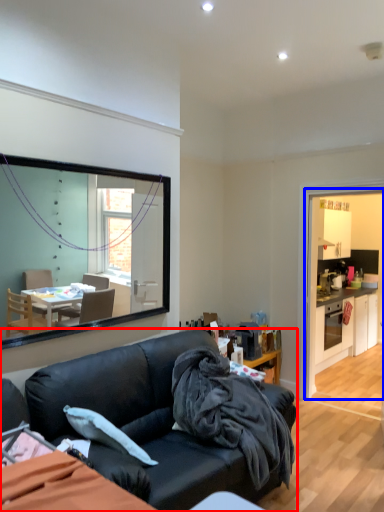
Question: Which point is closer to the camera, studio couch (highlighted by a red box) or dresser (highlighted by a blue box)?

Choices:
 (A) studio couch
 (B) dresser

Answer: (A)